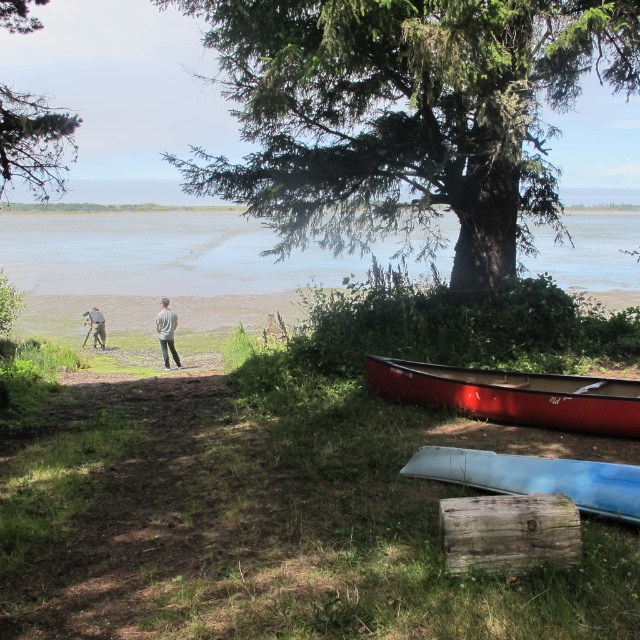
You are a photographer standing in the scene. You notice the brown sandy water at center and the gray fabric pants at center. Which object is higher in the image?

The brown sandy water at center is above the gray fabric pants at center, so the brown sandy water at center is higher in the image.